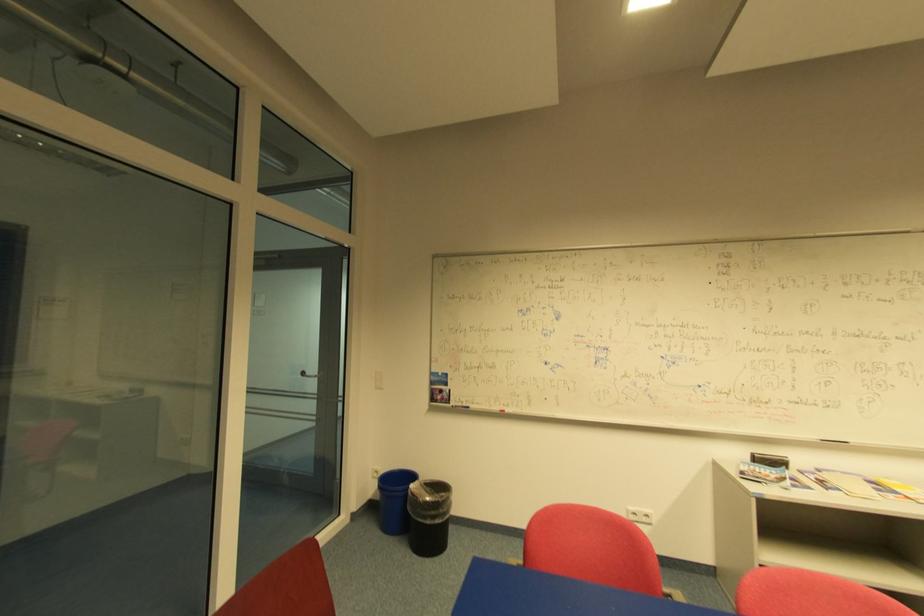
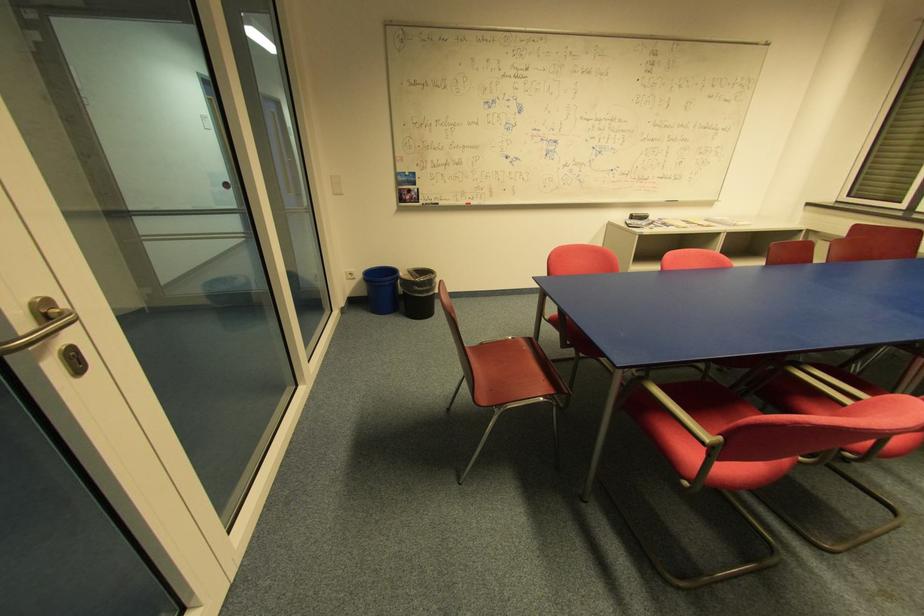
Where in the second image is the point corresponding to pixel 416 485 from the first image?

(405, 275)